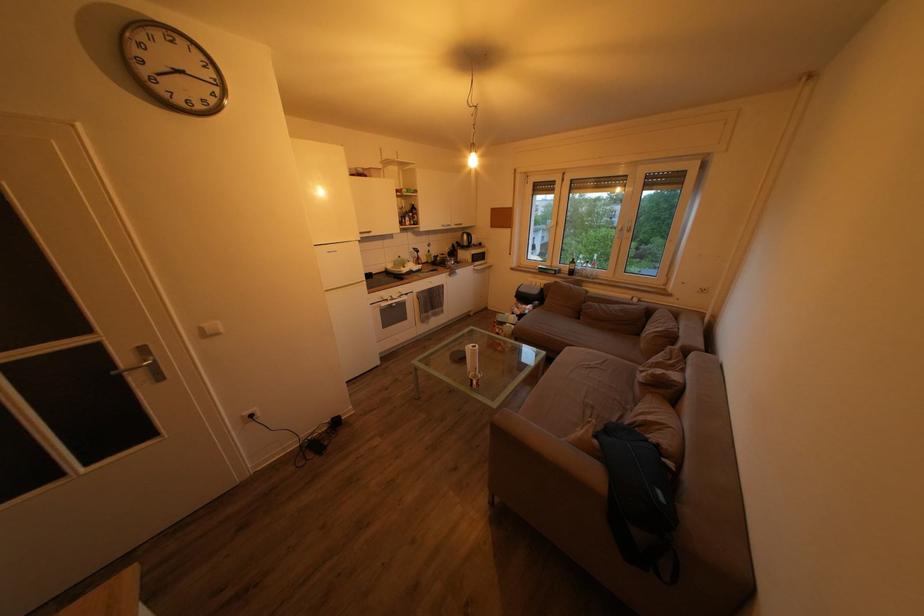
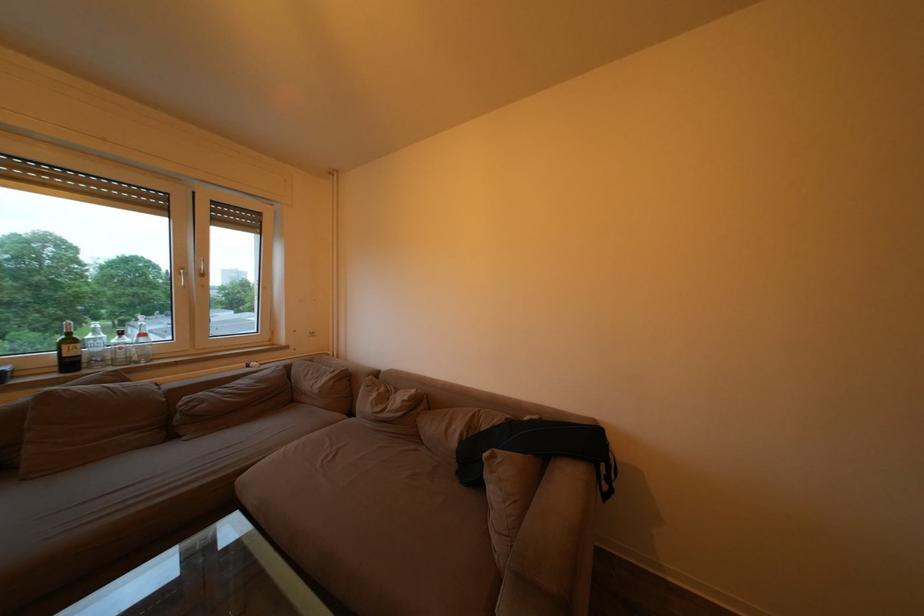
Find the pixel in the second image that matches point 596,268 in the first image.

(129, 339)